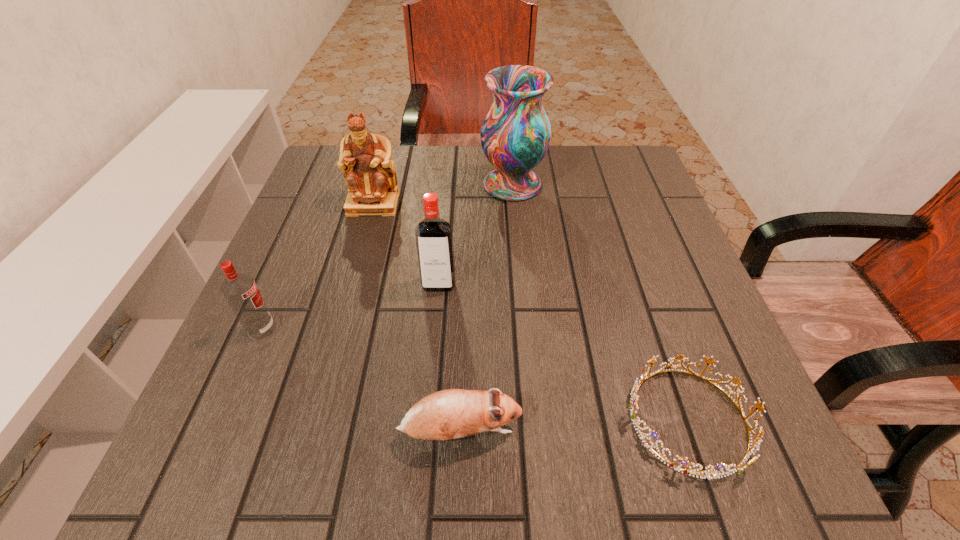
At what (x,y) coordinates should I click in order to perform the action: click on vacant space at the near left corner of the desktop. Please return your answer as a coordinate pair (x, y). The width and height of the screenshot is (960, 540). Looking at the image, I should click on (219, 444).

At what (x,y) coordinates should I click in order to perform the action: click on vacant space at the far right corner of the desktop. Please return your answer as a coordinate pair (x, y). This screenshot has height=540, width=960. Looking at the image, I should click on (647, 191).

The width and height of the screenshot is (960, 540). What are the coordinates of `unoccupied position between the rightmost object and the hamster` in the screenshot? It's located at (574, 426).

Where is `free spot between the fifth object from right to left and the hamster`? The width and height of the screenshot is (960, 540). free spot between the fifth object from right to left and the hamster is located at coordinates (417, 318).

Locate an element on the screen. The width and height of the screenshot is (960, 540). vacant point located between the vase and the hamster is located at coordinates (487, 308).

The image size is (960, 540). I want to click on free area in between the right vodka and the figurine, so click(406, 244).

Image resolution: width=960 pixels, height=540 pixels. I want to click on vacant space that is in between the figurine and the tiara, so click(x=531, y=312).

This screenshot has width=960, height=540. Find the location of `vacant area between the vase and the shorter vodka`. vacant area between the vase and the shorter vodka is located at coordinates (387, 256).

You are a GUI agent. You are given a task and a screenshot of the screen. Output one action in this format:
    pyautogui.click(x=<x>, y=<y>)
    Task: Click on the free space between the figurine and the farther vodka
    Image resolution: width=960 pixels, height=540 pixels.
    Given the screenshot: What is the action you would take?
    pyautogui.click(x=406, y=244)

At what (x,y) coordinates should I click in order to perform the action: click on vacant space that's between the right vodka and the rightmost object. Please return your answer as a coordinate pair (x, y). Looking at the image, I should click on (564, 352).